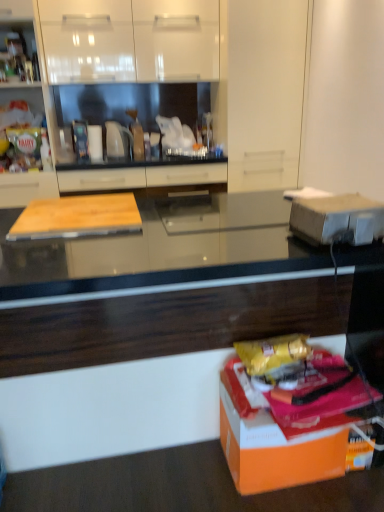
Question: Considering the relative sizes of matte wood cutting board at center, which is the third cabinetry from left to right, and black glossy countertop at center in the image provided, is matte wood cutting board at center, which is the third cabinetry from left to right, wider than black glossy countertop at center?

Choices:
 (A) yes
 (B) no

Answer: (B)

Question: Is black glossy countertop at center located within matte wood cutting board at center, the first cabinetry when ordered from right to left?

Choices:
 (A) no
 (B) yes

Answer: (A)

Question: Is matte wood cutting board at center, which is the third cabinetry from left to right, in front of black glossy countertop at center?

Choices:
 (A) no
 (B) yes

Answer: (A)

Question: Can you confirm if matte wood cutting board at center, the first cabinetry when ordered from right to left, is positioned to the left of black glossy countertop at center?

Choices:
 (A) yes
 (B) no

Answer: (A)

Question: Is matte wood cutting board at center, the first cabinetry when ordered from right to left, aimed at black glossy countertop at center?

Choices:
 (A) yes
 (B) no

Answer: (A)

Question: From a real-world perspective, is matte wood cutting board at center, the first cabinetry when ordered from right to left, physically above black glossy countertop at center?

Choices:
 (A) no
 (B) yes

Answer: (B)

Question: Is wooden cutting board at left, the 3th cabinetry when ordered from right to left, oriented away from matte wood cutting board at center, the first cabinetry when ordered from right to left?

Choices:
 (A) no
 (B) yes

Answer: (A)

Question: Does wooden cutting board at left, the 3th cabinetry when ordered from right to left, appear on the left side of matte wood cutting board at center, which is the third cabinetry from left to right?

Choices:
 (A) yes
 (B) no

Answer: (A)

Question: Does wooden cutting board at left, the 3th cabinetry when ordered from right to left, come in front of matte wood cutting board at center, which is the third cabinetry from left to right?

Choices:
 (A) no
 (B) yes

Answer: (A)

Question: Can you confirm if wooden cutting board at left, which ranks as the 1th cabinetry in left-to-right order, is shorter than matte wood cutting board at center, the first cabinetry when ordered from right to left?

Choices:
 (A) no
 (B) yes

Answer: (A)

Question: Does wooden cutting board at left, which ranks as the 1th cabinetry in left-to-right order, lie behind matte wood cutting board at center, which is the third cabinetry from left to right?

Choices:
 (A) yes
 (B) no

Answer: (A)

Question: Is wooden cutting board at left, which ranks as the 1th cabinetry in left-to-right order, outside matte wood cutting board at center, which is the third cabinetry from left to right?

Choices:
 (A) yes
 (B) no

Answer: (A)

Question: Could you tell me if white glossy cabinet at upper center, the second cabinetry from the right, is facing black glossy countertop at center?

Choices:
 (A) yes
 (B) no

Answer: (B)